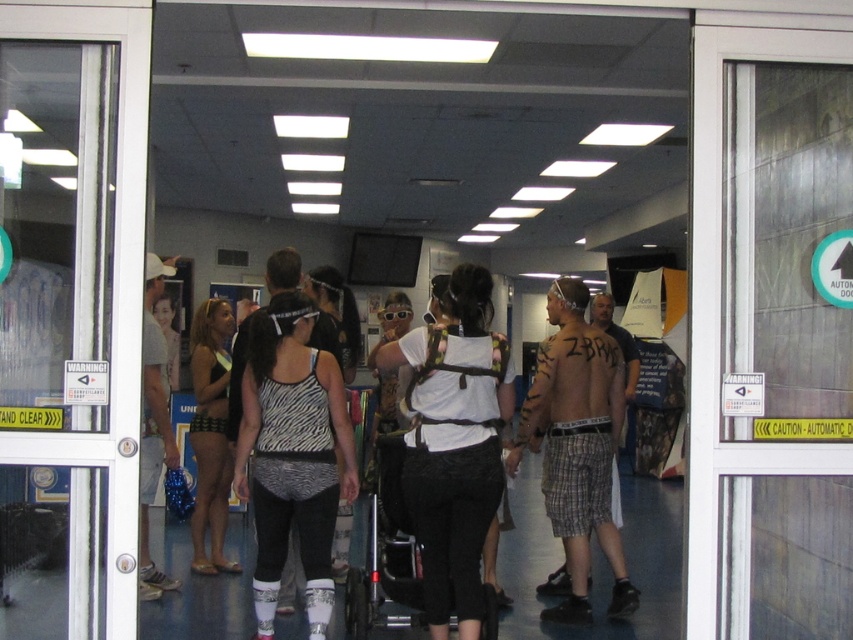
Is white matte tank top at center below zebra print tank top at center?

No.

Between point (473, 500) and point (259, 579), which one is positioned behind?

The point (259, 579) is more distant.

The width and height of the screenshot is (853, 640). I want to click on white matte tank top at center, so click(x=453, y=442).

From the picture: Can you confirm if transparent glass door at center is taller than plaid shorts at center?

Correct, transparent glass door at center is much taller as plaid shorts at center.

Is transparent glass door at center positioned behind plaid shorts at center?

No, it is in front of plaid shorts at center.

Is point (712, 400) less distant than point (566, 397)?

That is True.

This screenshot has height=640, width=853. Find the location of `transparent glass door at center`. transparent glass door at center is located at coordinates (720, 284).

This screenshot has height=640, width=853. In order to click on transparent glass door at center in this screenshot , I will do `click(720, 284)`.

Who is positioned more to the right, transparent glass door at center or white matte tank top at left?

transparent glass door at center is more to the right.

Who is more forward, (x=698, y=108) or (x=155, y=595)?

Positioned in front is point (x=698, y=108).

The height and width of the screenshot is (640, 853). I want to click on transparent glass door at center, so click(720, 284).